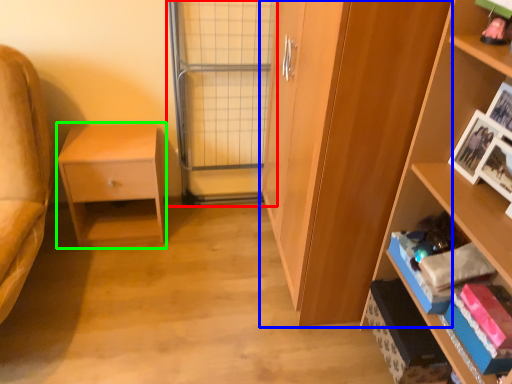
Question: Which object is positioned farthest from screen door (highlighted by a red box)? Select from cabinetry (highlighted by a blue box) and nightstand (highlighted by a green box).

Choices:
 (A) cabinetry
 (B) nightstand

Answer: (A)